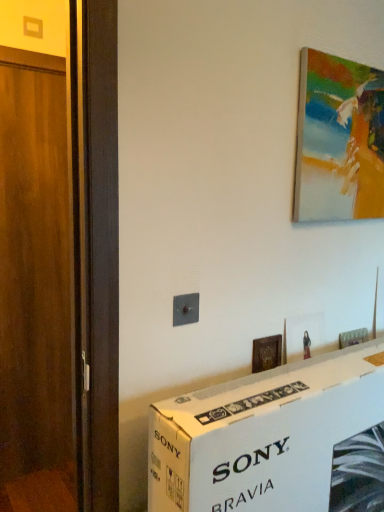
Question: From the image's perspective, is wooden picture frame at center, the 1th picture frame when ordered from left to right, beneath metallic switch at center?

Choices:
 (A) yes
 (B) no

Answer: (A)

Question: Is wooden picture frame at center, which ranks as the 2th picture frame in top-to-bottom order, further to the viewer compared to metallic switch at center?

Choices:
 (A) yes
 (B) no

Answer: (A)

Question: Does wooden picture frame at center, the second picture frame positioned from the right, appear on the left side of metallic switch at center?

Choices:
 (A) no
 (B) yes

Answer: (A)

Question: Is wooden picture frame at center, which is the 1th picture frame in bottom-to-top order, closer to the viewer compared to metallic switch at center?

Choices:
 (A) no
 (B) yes

Answer: (A)

Question: From a real-world perspective, is wooden picture frame at center, which ranks as the 2th picture frame in top-to-bottom order, positioned over metallic switch at center based on gravity?

Choices:
 (A) no
 (B) yes

Answer: (A)

Question: Is point (374, 398) closer or farther from the camera than point (178, 297)?

Choices:
 (A) farther
 (B) closer

Answer: (A)

Question: Relative to metallic switch at center, is white cardboard box at lower center in front or behind?

Choices:
 (A) behind
 (B) front

Answer: (B)

Question: From a real-world perspective, relative to metallic switch at center, is white cardboard box at lower center vertically above or below?

Choices:
 (A) below
 (B) above

Answer: (A)

Question: Considering the positions of white cardboard box at lower center and metallic switch at center in the image, is white cardboard box at lower center wider or thinner than metallic switch at center?

Choices:
 (A) wide
 (B) thin

Answer: (A)

Question: Does point pyautogui.click(x=18, y=212) appear closer or farther from the camera than point pyautogui.click(x=274, y=456)?

Choices:
 (A) closer
 (B) farther

Answer: (B)

Question: From a real-world perspective, is wooden door at left physically located above or below white cardboard box at lower center?

Choices:
 (A) below
 (B) above

Answer: (B)

Question: Would you say wooden door at left is to the left or to the right of white cardboard box at lower center in the picture?

Choices:
 (A) left
 (B) right

Answer: (A)

Question: From their relative heights in the image, would you say wooden door at left is taller or shorter than white cardboard box at lower center?

Choices:
 (A) short
 (B) tall

Answer: (B)

Question: Is wooden door at left to the left or to the right of painted canvas at upper right, the first picture frame when ordered from right to left, in the image?

Choices:
 (A) left
 (B) right

Answer: (A)

Question: Considering the positions of wooden door at left and painted canvas at upper right, the first picture frame when ordered from top to bottom, in the image, is wooden door at left bigger or smaller than painted canvas at upper right, the first picture frame when ordered from top to bottom,?

Choices:
 (A) big
 (B) small

Answer: (A)